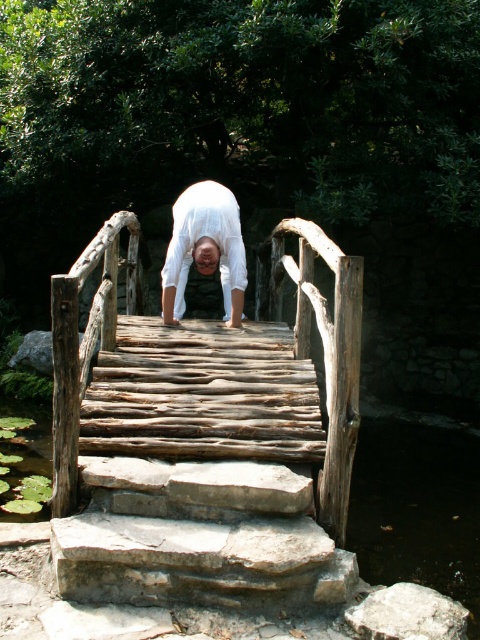
Question: Observing the image, what is the correct spatial positioning of rustic wooden bridge at center in reference to white matte/soft fabric at center?

Choices:
 (A) left
 (B) right

Answer: (B)

Question: Among these objects, which one is nearest to the camera?

Choices:
 (A) white matte/soft fabric at center
 (B) rustic wooden bridge at center

Answer: (B)

Question: Is rustic wooden bridge at center behind white matte/soft fabric at center?

Choices:
 (A) yes
 (B) no

Answer: (B)

Question: Does rustic wooden bridge at center appear on the left side of white matte/soft fabric at center?

Choices:
 (A) yes
 (B) no

Answer: (B)

Question: Which point is closer to the camera?

Choices:
 (A) (213, 260)
 (B) (55, 355)

Answer: (B)